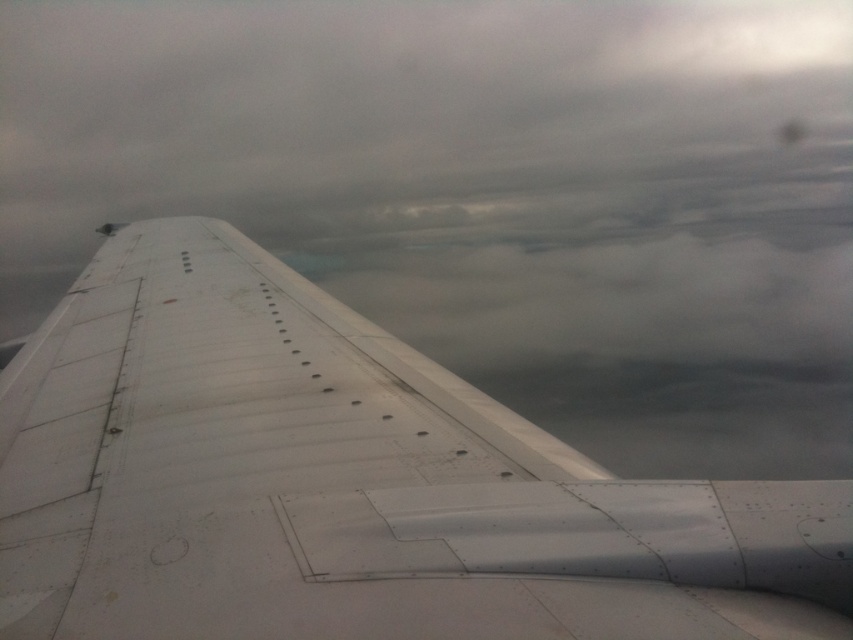
Question: Can you confirm if white matte wing at center is bigger than metallic white wing at center?

Choices:
 (A) yes
 (B) no

Answer: (A)

Question: Which object is farther from the camera taking this photo?

Choices:
 (A) white matte wing at center
 (B) metallic white wing at center

Answer: (A)

Question: Among these objects, which one is farthest from the camera?

Choices:
 (A) white matte wing at center
 (B) metallic white wing at center

Answer: (A)

Question: Observing the image, what is the correct spatial positioning of white matte wing at center in reference to metallic white wing at center?

Choices:
 (A) above
 (B) below

Answer: (A)

Question: Can you confirm if white matte wing at center is smaller than metallic white wing at center?

Choices:
 (A) yes
 (B) no

Answer: (B)